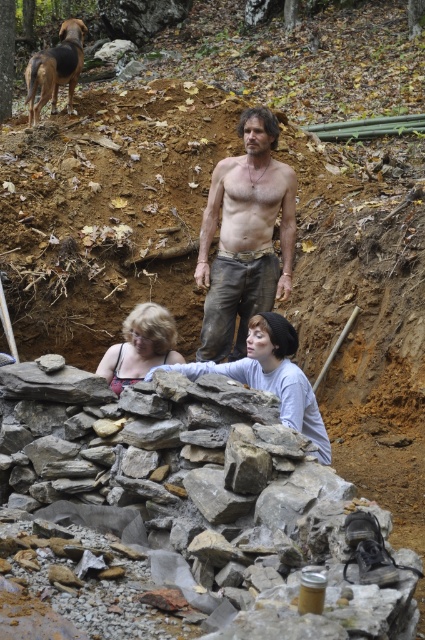
Who is more forward, (16, 552) or (224, 182)?

Point (16, 552) is more forward.

Who is higher up, gray rough stone at center or rough denim pants at center?

rough denim pants at center is higher up.

You are a GUI agent. You are given a task and a screenshot of the screen. Output one action in this format:
    pyautogui.click(x=<x>, y=<y>)
    Task: Click on the gray rough stone at center
    The width and height of the screenshot is (425, 640).
    Given the screenshot: What is the action you would take?
    pyautogui.click(x=195, y=497)

Which is below, gray rough stone at center or rough stone wall at center?

gray rough stone at center is below.

Which is above, gray rough stone at center or rough stone wall at center?

rough stone wall at center is above.

Is point (176, 445) farther from camera compared to point (274, 353)?

No, (176, 445) is closer to viewer.

Where is `gray rough stone at center`? Image resolution: width=425 pixels, height=640 pixels. gray rough stone at center is located at coordinates (195, 497).

Which of these two, rough stone wall at center or matte black tank top at center, stands taller?

rough stone wall at center

Is point (292, 381) positioned before point (136, 349)?

Yes, point (292, 381) is closer to viewer.

Measure the distance between rough stone wall at center and camera.

rough stone wall at center and camera are 5.49 meters apart.

The image size is (425, 640). Identify the location of rough stone wall at center. (272, 376).